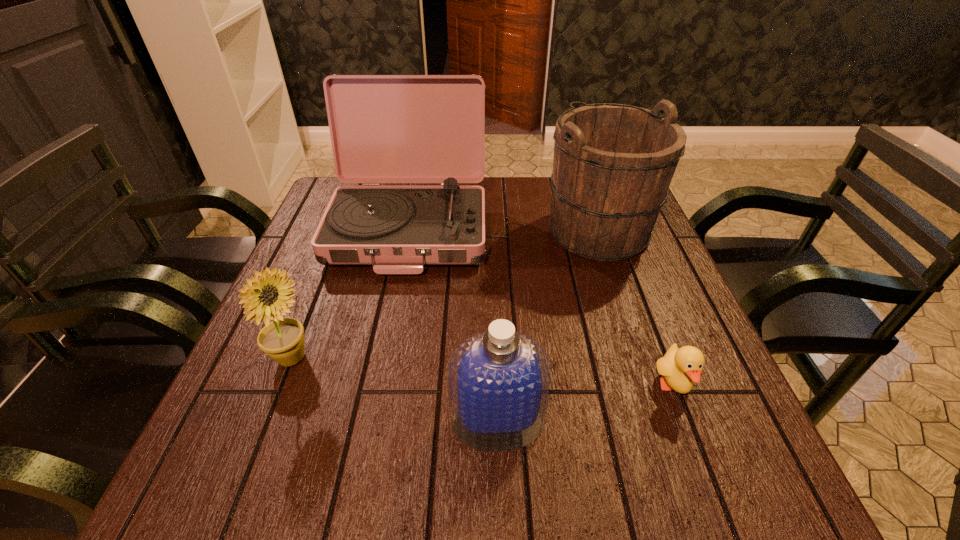
Where is `free point at the left edge`? Image resolution: width=960 pixels, height=540 pixels. free point at the left edge is located at coordinates (309, 284).

Find the location of a particular element. This screenshot has width=960, height=540. unoccupied area between the sunflower and the cleansing agent is located at coordinates pos(395,390).

Locate an element on the screen. vacant area that lies between the record player and the shortest object is located at coordinates (541, 307).

In order to click on free area in between the sunflower and the record player in this screenshot , I will do `click(350, 293)`.

At what (x,y) coordinates should I click in order to perform the action: click on free space between the duckling and the bucket. Please return your answer as a coordinate pair (x, y). Image resolution: width=960 pixels, height=540 pixels. Looking at the image, I should click on (636, 308).

At what (x,y) coordinates should I click in order to perform the action: click on vacant area that lies between the bucket and the record player. Please return your answer as a coordinate pair (x, y). The height and width of the screenshot is (540, 960). Looking at the image, I should click on (504, 229).

You are a GUI agent. You are given a task and a screenshot of the screen. Output one action in this format:
    pyautogui.click(x=<x>, y=<y>)
    Task: Click on the unoccupied area between the shortest object and the record player
    This screenshot has width=960, height=540.
    Given the screenshot: What is the action you would take?
    pyautogui.click(x=541, y=307)

Image resolution: width=960 pixels, height=540 pixels. In order to click on free space between the duckling and the cleansing agent in this screenshot , I will do `click(586, 404)`.

Locate an element on the screen. Image resolution: width=960 pixels, height=540 pixels. empty space that is in between the sunflower and the cleansing agent is located at coordinates (395, 390).

Identify the location of vacant area that lies between the record player and the duckling. (541, 307).